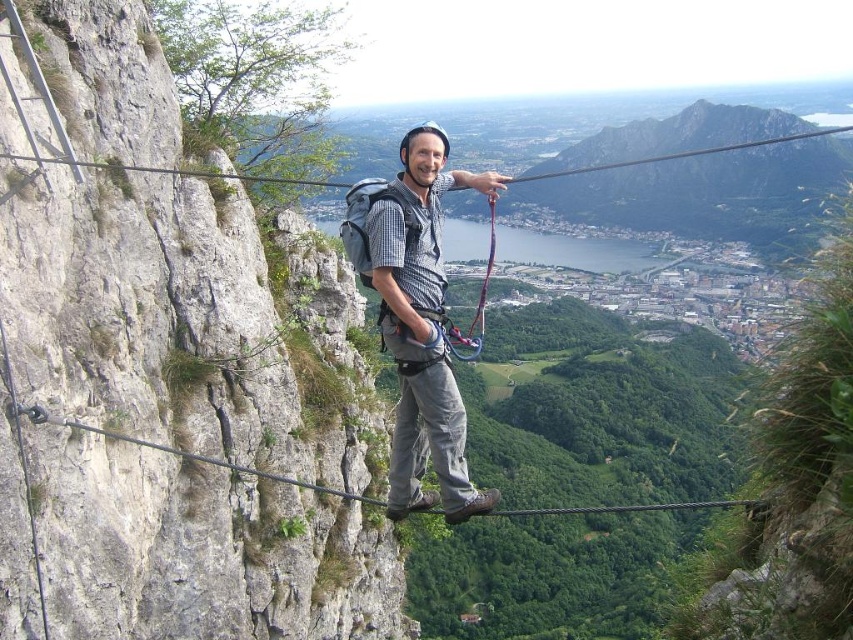
You are a safety inspector checking the via ferrata setup. You notice the smooth gray rock at left and the matte gray helmet at center. Which object is smaller in size?

The smooth gray rock at left is smaller in size compared to the matte gray helmet at center.

Based on the scene description, what is the color and material of the object located at coordinates point (184, 323)?

The point (184, 323) corresponds to smooth gray rock at left.